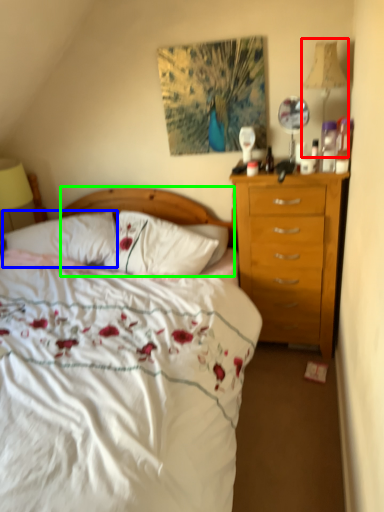
Question: Which object is positioned farthest from bedside lamp (highlighted by a red box)? Select from pillow (highlighted by a blue box) and headboard (highlighted by a green box).

Choices:
 (A) pillow
 (B) headboard

Answer: (A)